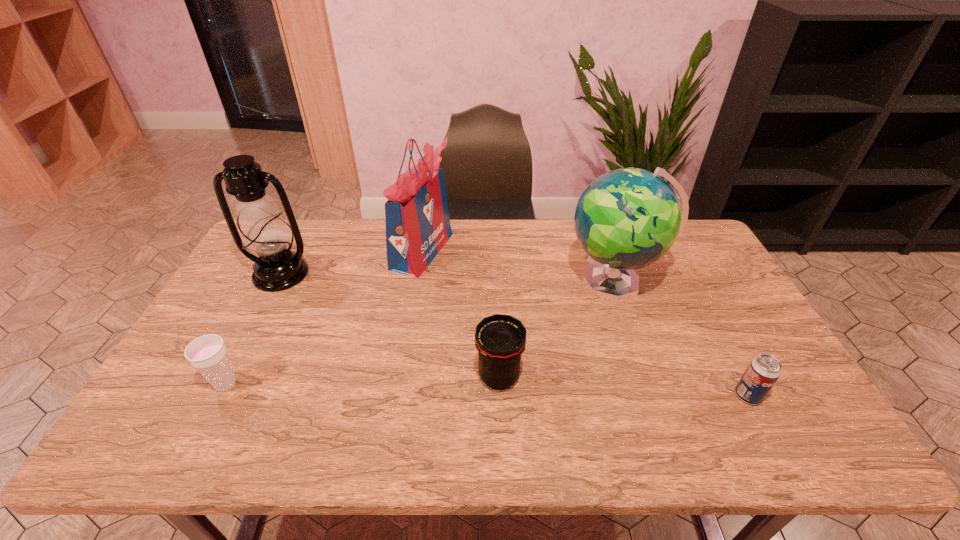
Image resolution: width=960 pixels, height=540 pixels. Identify the location of grocery bag. click(417, 220).

The image size is (960, 540). In order to click on the fifth object from left to right in this screenshot , I will do `click(628, 218)`.

In order to click on oil lamp in this screenshot , I will do `click(264, 232)`.

Locate an element on the screen. telephoto lens is located at coordinates (x=500, y=339).

Find the location of a particular element. The width and height of the screenshot is (960, 540). cup is located at coordinates (207, 353).

The width and height of the screenshot is (960, 540). Identify the location of beer can. (764, 370).

What are the coordinates of `blank space located 0.380m on the front-facing side of the fourth object from right to left` in the screenshot? It's located at coord(563,251).

Where is `free space located on the front surface of the second object from right to left`? free space located on the front surface of the second object from right to left is located at coordinates (543, 282).

The height and width of the screenshot is (540, 960). Find the location of `vacant space located on the front surface of the second object from right to left`. vacant space located on the front surface of the second object from right to left is located at coordinates pos(448,282).

What are the coordinates of `free space located on the front surface of the second object from right to left` in the screenshot? It's located at (509, 282).